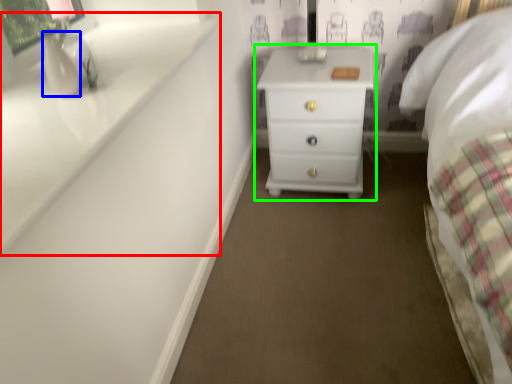
Question: Considering the real-world distances, which object is farthest from window sill (highlighted by a red box)? vase (highlighted by a blue box) or chest of drawers (highlighted by a green box)?

Choices:
 (A) vase
 (B) chest of drawers

Answer: (B)